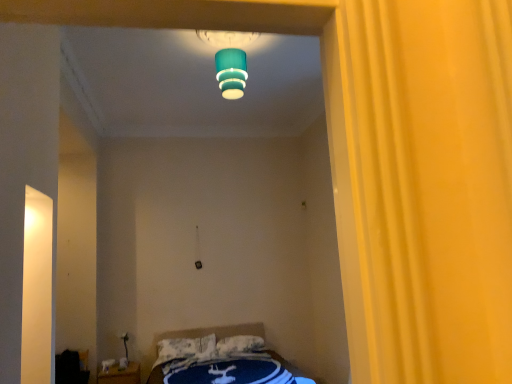
Question: Would you say teal matte lampshade at upper center is to the left or to the right of white textured pillow at center, which is the second pillow in right-to-left order, in the picture?

Choices:
 (A) left
 (B) right

Answer: (B)

Question: Considering the positions of teal matte lampshade at upper center and white textured pillow at center, the 1th pillow positioned from the left, in the image, is teal matte lampshade at upper center wider or thinner than white textured pillow at center, the 1th pillow positioned from the left,?

Choices:
 (A) thin
 (B) wide

Answer: (B)

Question: Based on their relative distances, which object is nearer to the blue fabric bed at lower center?

Choices:
 (A) teal matte lampshade at upper center
 (B) wooden nightstand at lower left
 (C) white textured pillow at center, the 1th pillow positioned from the left
 (D) black fabric bag at lower left
 (E) white soft pillow at lower center, the 2th pillow when ordered from left to right

Answer: (C)

Question: Estimate the real-world distances between objects in this image. Which object is closer to the wooden nightstand at lower left?

Choices:
 (A) blue fabric bed at lower center
 (B) black fabric bag at lower left
 (C) white textured pillow at center, which is the second pillow in right-to-left order
 (D) white soft pillow at lower center, the 2th pillow when ordered from left to right
 (E) teal matte lampshade at upper center

Answer: (B)